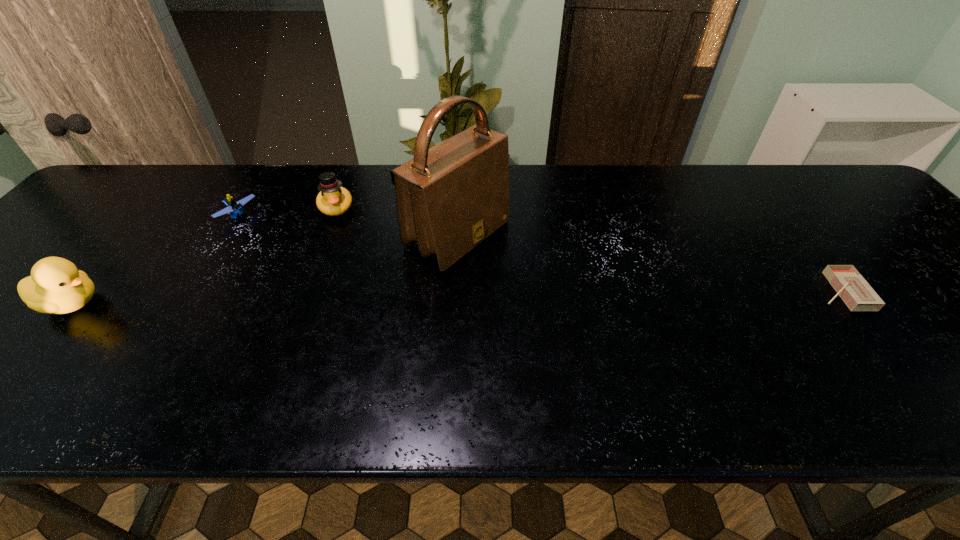
Find the location of a particular element. The height and width of the screenshot is (540, 960). vacant space on the desktop that is between the leftmost object and the rightmost object and is positioned on the front-facing side of the right duck is located at coordinates (354, 299).

At what (x,y) coordinates should I click in order to perform the action: click on vacant space on the desktop that is between the left duck and the matchbox and is positioned on the front flap of the fourth object from left to right. Please return your answer as a coordinate pair (x, y). Looking at the image, I should click on (563, 295).

Locate an element on the screen. Image resolution: width=960 pixels, height=540 pixels. vacant space on the desktop that is between the left duck and the rightmost object and is positioned on the front-facing side of the fourth object from right to left is located at coordinates (361, 299).